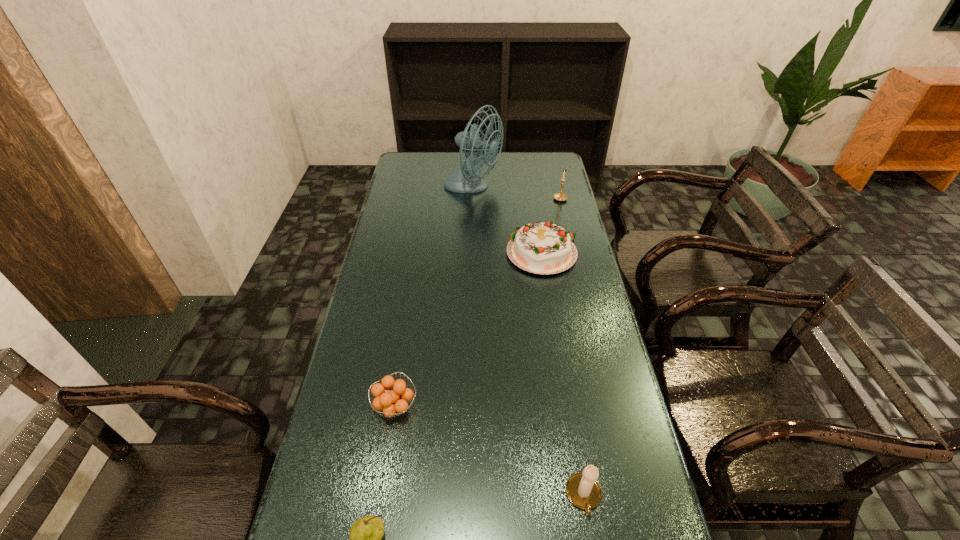
Where is `vacant space situated on the back of the shortest object`? vacant space situated on the back of the shortest object is located at coordinates (410, 312).

The image size is (960, 540). Identify the location of object that is at the far edge. (465, 179).

Where is `object situated at the left edge`? object situated at the left edge is located at coordinates (393, 402).

At what (x,y) coordinates should I click in order to perform the action: click on cake located at the right edge. Please return your answer as a coordinate pair (x, y). This screenshot has width=960, height=540. Looking at the image, I should click on (542, 248).

Where is `free region at the far edge of the desktop`? The image size is (960, 540). free region at the far edge of the desktop is located at coordinates (524, 159).

Identify the location of vacant region at the left edge of the desktop. The height and width of the screenshot is (540, 960). [410, 270].

Find the location of `vacant region at the right edge of the desktop`. vacant region at the right edge of the desktop is located at coordinates (628, 448).

The height and width of the screenshot is (540, 960). Find the location of `unoccupied area between the cake and the second nearest object`. unoccupied area between the cake and the second nearest object is located at coordinates (564, 375).

Locate an element on the screen. The width and height of the screenshot is (960, 540). vacant space that's between the shortest object and the right candle holder is located at coordinates (478, 303).

Image resolution: width=960 pixels, height=540 pixels. Identify the location of blank region between the second nearest object and the tallest object. [x=528, y=342].